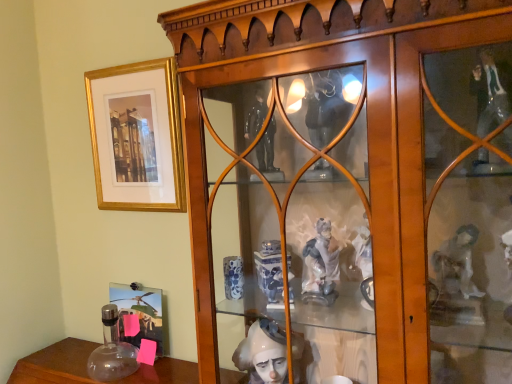
Question: Considering the positions of wooden cabinet at center and gold/matte picture frame at upper left, which ranks as the first picture frame in top-to-bottom order, in the image, is wooden cabinet at center bigger or smaller than gold/matte picture frame at upper left, which ranks as the first picture frame in top-to-bottom order,?

Choices:
 (A) small
 (B) big

Answer: (B)

Question: Relative to gold/matte picture frame at upper left, which ranks as the first picture frame in top-to-bottom order, is wooden cabinet at center in front or behind?

Choices:
 (A) front
 (B) behind

Answer: (A)

Question: Which object is the farthest from the wooden cabinet at center?

Choices:
 (A) metallic silver photo frame at lower left, the first picture frame when ordered from bottom to top
 (B) gold/matte picture frame at upper left, acting as the second picture frame starting from the bottom

Answer: (A)

Question: Estimate the real-world distances between objects in this image. Which object is closer to the gold/matte picture frame at upper left, acting as the second picture frame starting from the bottom?

Choices:
 (A) metallic silver photo frame at lower left, the first picture frame when ordered from bottom to top
 (B) wooden cabinet at center

Answer: (B)